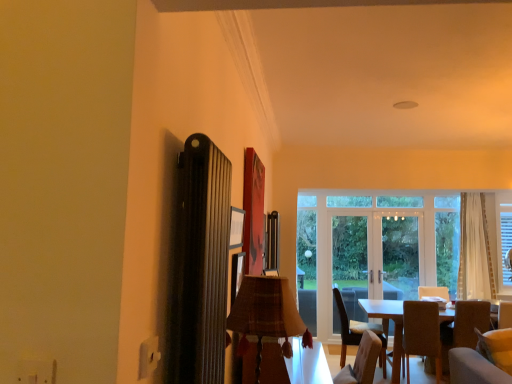
Question: Is transparent glass window at center further to camera compared to brown fabric chair at lower right, which is the second chair from left to right?

Choices:
 (A) no
 (B) yes

Answer: (B)

Question: Can you confirm if transparent glass window at center is positioned to the right of brown fabric chair at lower right, which is the second chair from left to right?

Choices:
 (A) no
 (B) yes

Answer: (B)

Question: Considering the relative sizes of transparent glass window at center and brown fabric chair at lower right, which is the second chair from left to right, in the image provided, is transparent glass window at center smaller than brown fabric chair at lower right, which is the second chair from left to right,?

Choices:
 (A) no
 (B) yes

Answer: (B)

Question: Considering the relative sizes of transparent glass window at center and brown fabric chair at lower right, which is the first chair in right-to-left order, in the image provided, is transparent glass window at center shorter than brown fabric chair at lower right, which is the first chair in right-to-left order,?

Choices:
 (A) yes
 (B) no

Answer: (B)

Question: Is transparent glass window at center bigger than brown fabric chair at lower right, which is the second chair from left to right?

Choices:
 (A) no
 (B) yes

Answer: (A)

Question: Is transparent glass window at center aimed at brown fabric chair at lower right, which is the first chair in right-to-left order?

Choices:
 (A) no
 (B) yes

Answer: (B)

Question: Is white sheer curtain at right wider than clear glass door at center, which is the first screen door in right-to-left order?

Choices:
 (A) no
 (B) yes

Answer: (B)

Question: Considering the relative sizes of white sheer curtain at right and clear glass door at center, which is the first screen door in right-to-left order, in the image provided, is white sheer curtain at right thinner than clear glass door at center, which is the first screen door in right-to-left order,?

Choices:
 (A) yes
 (B) no

Answer: (B)

Question: Is white sheer curtain at right at the left side of clear glass door at center, which is the first screen door in right-to-left order?

Choices:
 (A) yes
 (B) no

Answer: (B)

Question: Is white sheer curtain at right beside clear glass door at center, the 2th screen door viewed from the left?

Choices:
 (A) no
 (B) yes

Answer: (A)

Question: Is white sheer curtain at right not close to clear glass door at center, the 2th screen door viewed from the left?

Choices:
 (A) yes
 (B) no

Answer: (B)

Question: Is white sheer curtain at right oriented towards clear glass door at center, which is the first screen door in right-to-left order?

Choices:
 (A) yes
 (B) no

Answer: (B)

Question: Is clear glass door at center, which is counted as the 1th screen door, starting from the left, far away from brown fabric chair at lower right, which is counted as the second chair, starting from the right?

Choices:
 (A) yes
 (B) no

Answer: (B)